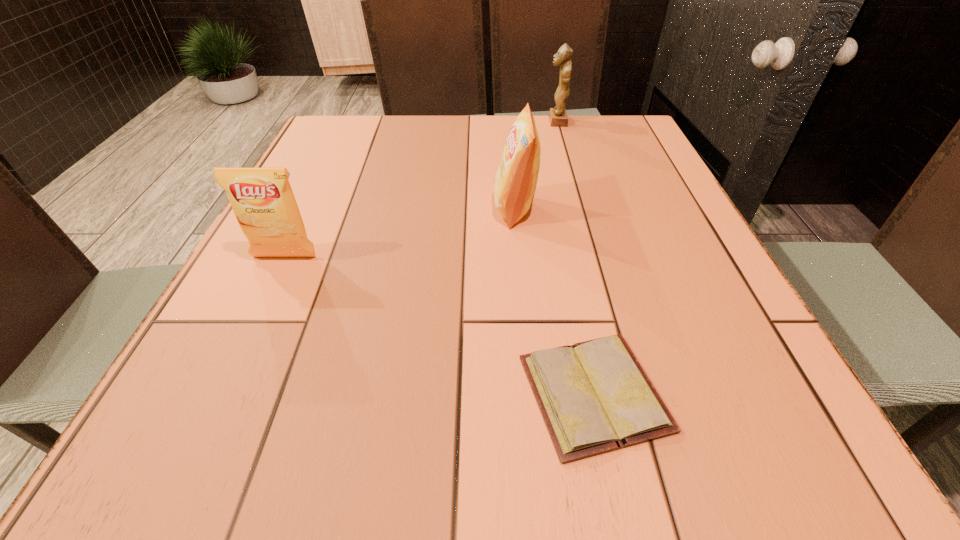
The width and height of the screenshot is (960, 540). Identify the location of free space at the left edge. (319, 217).

Locate an element on the screen. Image resolution: width=960 pixels, height=540 pixels. vacant space at the right edge is located at coordinates [728, 281].

In the image, there is a desktop. Identify the location of vacant space at the far left corner. (373, 120).

Image resolution: width=960 pixels, height=540 pixels. In order to click on vacant space at the far right corner in this screenshot , I will do `click(595, 150)`.

Locate an element on the screen. vacant area that lies between the farthest object and the leftmost object is located at coordinates (420, 189).

Image resolution: width=960 pixels, height=540 pixels. What are the coordinates of `vacant space that is in between the nearest object and the second farthest object` in the screenshot? It's located at pyautogui.click(x=554, y=301).

You are a GUI agent. You are given a task and a screenshot of the screen. Output one action in this format:
    pyautogui.click(x=<x>, y=<y>)
    Task: Click on the unoccupied position between the figurine and the second nearest object
    This screenshot has height=540, width=960.
    Given the screenshot: What is the action you would take?
    pyautogui.click(x=420, y=189)

Find the location of a particular element. The width and height of the screenshot is (960, 540). free space between the farthest object and the nearer crisp (potato chip) is located at coordinates (420, 189).

This screenshot has height=540, width=960. Find the location of `free space between the right crisp (potato chip) and the nearer crisp (potato chip)`. free space between the right crisp (potato chip) and the nearer crisp (potato chip) is located at coordinates (399, 233).

Find the location of `vacant area between the leftmost object and the figurine`. vacant area between the leftmost object and the figurine is located at coordinates (420, 189).